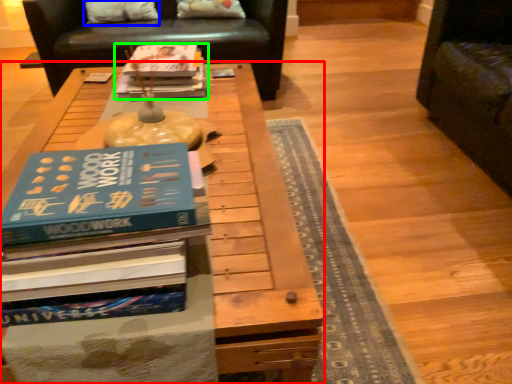
Question: Which is farther away from table (highlighted by a red box)? pillow (highlighted by a blue box) or book (highlighted by a green box)?

Choices:
 (A) pillow
 (B) book

Answer: (A)